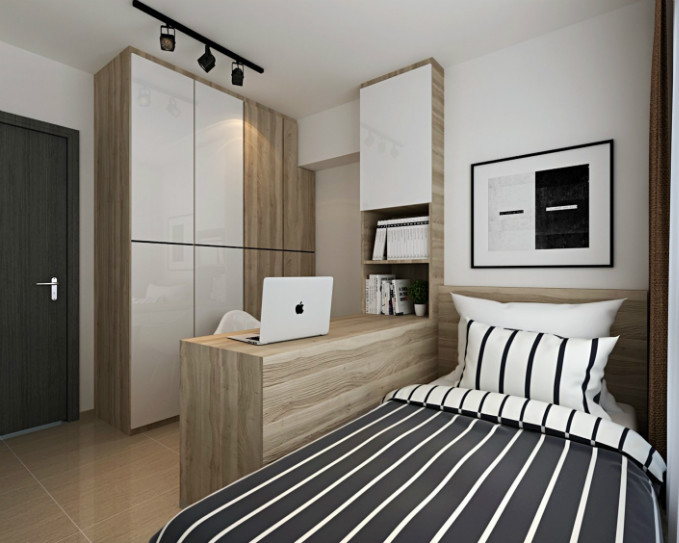
Image resolution: width=679 pixels, height=543 pixels. Find the location of `files`. files is located at coordinates (379, 245), (394, 239), (409, 239), (421, 238).